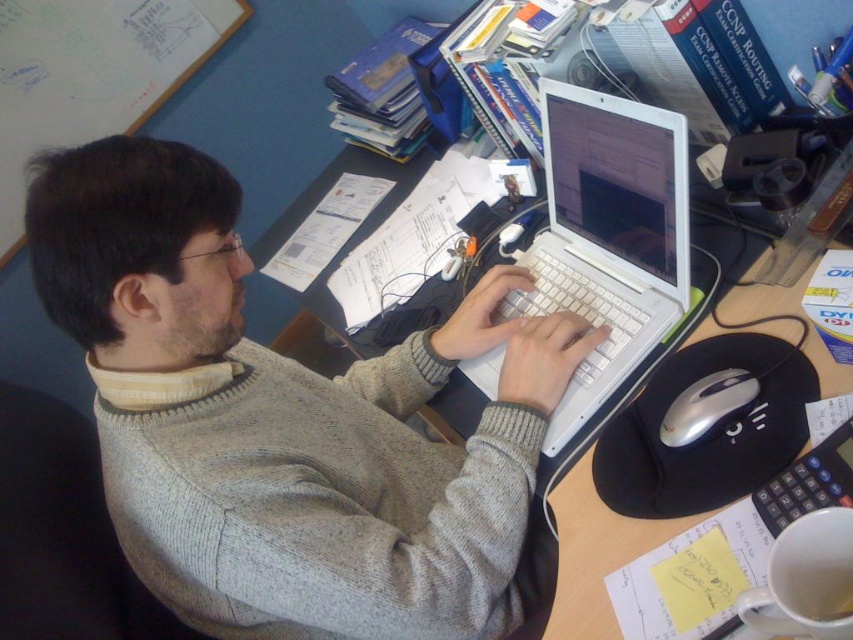
You are a person trying to organize your desk. You have two points marked on your desk, point [631,220] and point [723,381]. If you want to place an item closer to you, which point should you choose?

Point [723,381] is closer to you, so you should place the item there.

You are standing in front of the desk and want to reach the gray sweater at center. Is it within arm s reach?

The gray sweater at center is 26.21 inches from viewer, so yes, it is within arm reach.

What is located at the point with coordinates (608, 236) in the image?

The point at coordinates (608, 236) is where the white plastic laptop at center is located.